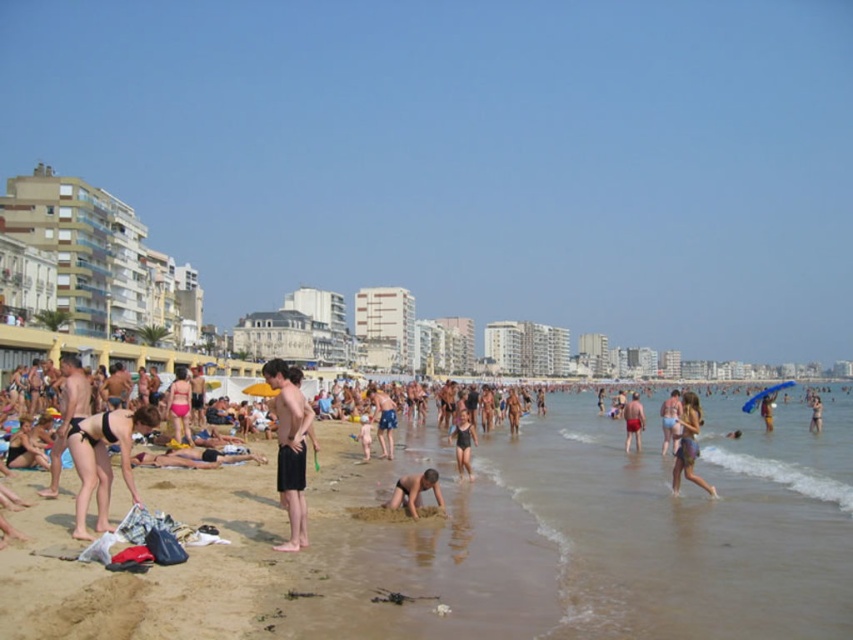
Does light blue swimsuit at center appear under red matte shorts at center?

No, light blue swimsuit at center is not below red matte shorts at center.

Is light blue swimsuit at center closer to the viewer compared to red matte shorts at center?

Yes, light blue swimsuit at center is closer to the viewer.

Which is in front, point (665, 451) or point (627, 424)?

Point (665, 451) is in front.

I want to click on light blue swimsuit at center, so click(x=670, y=420).

Does dark blue shorts at center have a larger size compared to black swimsuit at center?

Correct, dark blue shorts at center is larger in size than black swimsuit at center.

Is dark blue shorts at center further to the viewer compared to black swimsuit at center?

Yes, dark blue shorts at center is behind black swimsuit at center.

Is point (375, 394) behind point (460, 410)?

Yes.

This screenshot has width=853, height=640. What are the coordinates of `dark blue shorts at center` in the screenshot? It's located at pos(383,419).

Who is more forward, (85, 403) or (637, 436)?

Positioned in front is point (85, 403).

Is point (65, 355) less distant than point (636, 419)?

No, (65, 355) is behind (636, 419).

This screenshot has height=640, width=853. What are the coordinates of `matte black swimwear at left` in the screenshot? It's located at (67, 413).